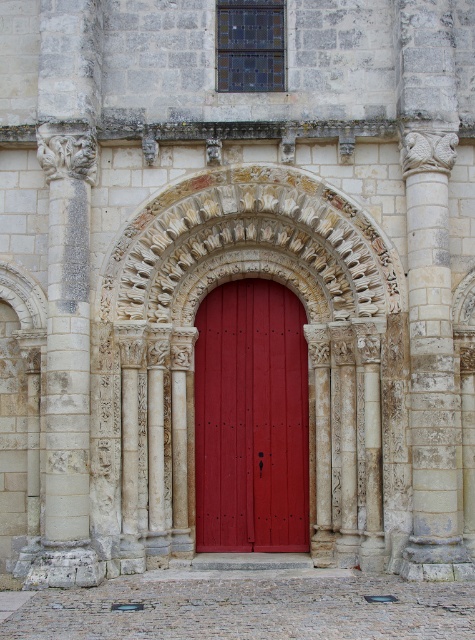
Is carved stone archway at center positioned in front of matte wood door at center?

Yes, it is in front of matte wood door at center.

You are a GUI agent. You are given a task and a screenshot of the screen. Output one action in this format:
    pyautogui.click(x=<x>, y=<y>)
    Task: Click on the carved stone archway at center
    
    Given the screenshot: What is the action you would take?
    pyautogui.click(x=249, y=369)

Where is `carved stone archway at center`? This screenshot has width=475, height=640. carved stone archway at center is located at coordinates (249, 369).